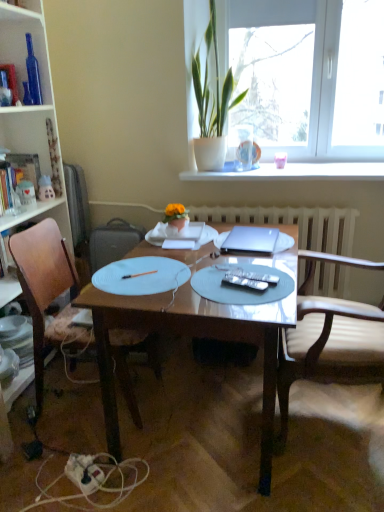
You are a GUI agent. You are given a task and a screenshot of the screen. Output one action in this format:
    pyautogui.click(x=<x>, y=<y>)
    Task: Click on the free point below white matte paper plate at center, the first paper plate in the left-to-right sequence (from a real-world perspective)
    The height and width of the screenshot is (512, 384).
    Given the screenshot: What is the action you would take?
    pyautogui.click(x=156, y=272)